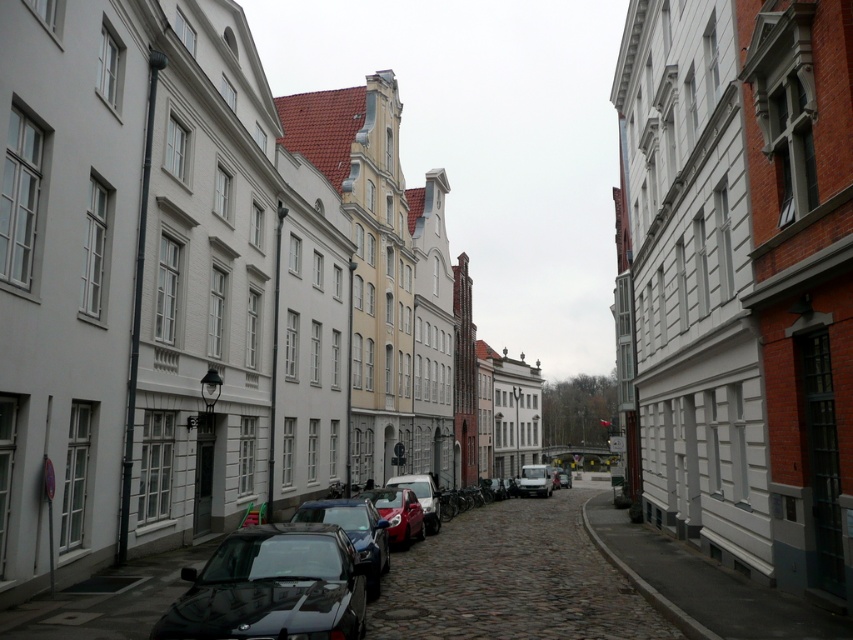
You are a delivery person trying to park your van in this narrow street. You see the white smooth wall at lower right and the shiny red car at center. Which object takes up more space in the scene?

The white smooth wall at lower right is bigger than the shiny red car at center, so it takes up more space in the scene.

You are standing at the starting point of the cobblestone street and want to reach the end of the street. There are two points marked on the path you need to pass through. Which point should you reach first, point (791, 602) or point (436, 518)?

You should reach point (791, 602) first because it is in front of point (436, 518) along the path.

You are a delivery person trying to park your 2.5 meters tall delivery van in this narrow street. You see the white smooth wall at lower right and the metallic silver car at center. Which object would block your path if you attempt to park your van?

The white smooth wall at lower right is much taller than the metallic silver car at center, so it would block the path of the delivery van due to its greater height.